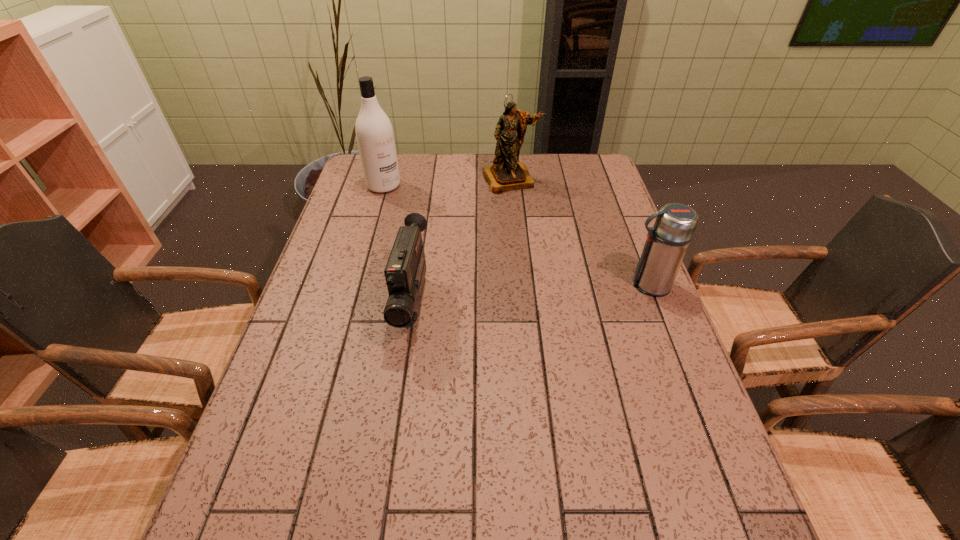
Where is `free spot on the desktop that is between the second object from left to right and the thermos bottle and is positioned on the front-facing side of the figurine`? free spot on the desktop that is between the second object from left to right and the thermos bottle and is positioned on the front-facing side of the figurine is located at coordinates (565, 292).

You are a GUI agent. You are given a task and a screenshot of the screen. Output one action in this format:
    pyautogui.click(x=<x>, y=<y>)
    Task: Click on the free spot on the desktop that is between the camcorder and the rightmost object and is positioned on the front-facing side of the shampoo
    The image size is (960, 540).
    Given the screenshot: What is the action you would take?
    pyautogui.click(x=512, y=296)